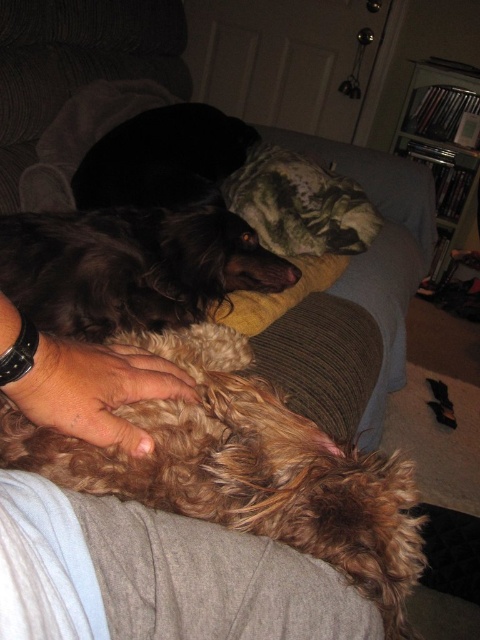
Between point (4, 577) and point (106, 234), which one is positioned behind?

The point (106, 234) is more distant.

Which is more to the right, brown furry dog at center or brown fuzzy dog at upper center?

Positioned to the right is brown furry dog at center.

Which is behind, point (235, 616) or point (59, 214)?

The point (59, 214) is more distant.

The width and height of the screenshot is (480, 640). Identify the location of brown furry dog at center. (156, 576).

Between brown furry dog at center and fuzzy brown fur at lower center, which one is positioned lower?

brown furry dog at center

Image resolution: width=480 pixels, height=640 pixels. I want to click on brown furry dog at center, so click(x=156, y=576).

Who is lower down, brown curly fur dog at center or fuzzy brown fur at lower center?

brown curly fur dog at center is below.

Can you confirm if brown curly fur dog at center is positioned above fuzzy brown fur at lower center?

No.

Who is more forward, (x=348, y=545) or (x=68, y=401)?

Point (x=348, y=545)

This screenshot has height=640, width=480. I want to click on brown curly fur dog at center, so click(x=247, y=470).